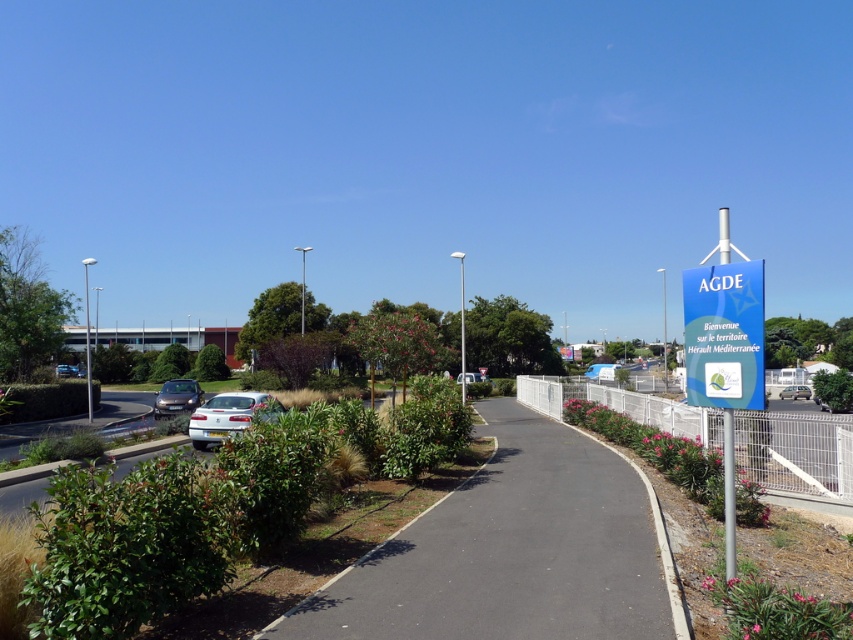
From the picture: You are driving a car and want to park near the black asphalt path at center. The silver metallic van at right is blocking your way. Can you drive around the van to reach the path?

The black asphalt path at center is not as tall as the silver metallic van at right, so you can drive around the van to reach the path since the path is lower than the van.

Consider the image. You are a tourist driving a car and want to park near the entrance of Agde. You see a silver metallic sedan at center and a silver metallic van at right. Which vehicle is closer to the blue sign on the right side of the frame?

The silver metallic van at right is closer to the blue sign on the right side of the frame because it is positioned to the right of the silver metallic sedan at center.

You are a delivery driver who needs to park your 2.5 meter wide truck between the silver metallic sedan at center and the silver metallic van at right. Can you fit your truck in the space between them?

The silver metallic sedan at center is wider than the silver metallic van at right. Since the sedan is wider, the space between them may not be sufficient for a 2.5 meter wide truck. You should check the exact dimensions before attempting to park.